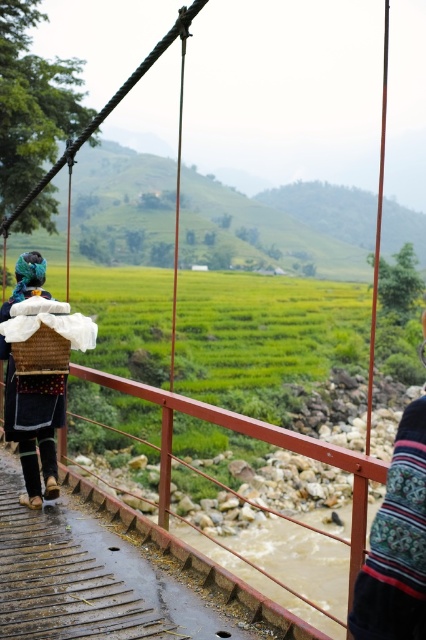
What do you see at coordinates (34, 424) in the screenshot?
I see `dark blue woven basket at left` at bounding box center [34, 424].

Can you confirm if dark blue woven basket at left is bigger than rustic woven basket at left?

Indeed, dark blue woven basket at left has a larger size compared to rustic woven basket at left.

Where is `dark blue woven basket at left`? dark blue woven basket at left is located at coordinates pos(34,424).

Between striped fabric shawl at center and dark blue woven basket at left, which one appears on the right side from the viewer's perspective?

From the viewer's perspective, striped fabric shawl at center appears more on the right side.

Is striped fabric shawl at center in front of dark blue woven basket at left?

That is True.

The image size is (426, 640). I want to click on striped fabric shawl at center, so click(x=397, y=544).

You are a GUI agent. You are given a task and a screenshot of the screen. Output one action in this format:
    pyautogui.click(x=<x>, y=<y>)
    Task: Click on the striped fabric shawl at center
    The width and height of the screenshot is (426, 640).
    Given the screenshot: What is the action you would take?
    pyautogui.click(x=397, y=544)

Which is more to the left, striped fabric shawl at center or rustic woven basket at left?

Positioned to the left is rustic woven basket at left.

Which of these two, striped fabric shawl at center or rustic woven basket at left, stands taller?

striped fabric shawl at center

Is point (411, 616) closer to viewer compared to point (60, 364)?

Yes, point (411, 616) is closer to viewer.

Find the location of a particular element. The width and height of the screenshot is (426, 640). striped fabric shawl at center is located at coordinates (397, 544).